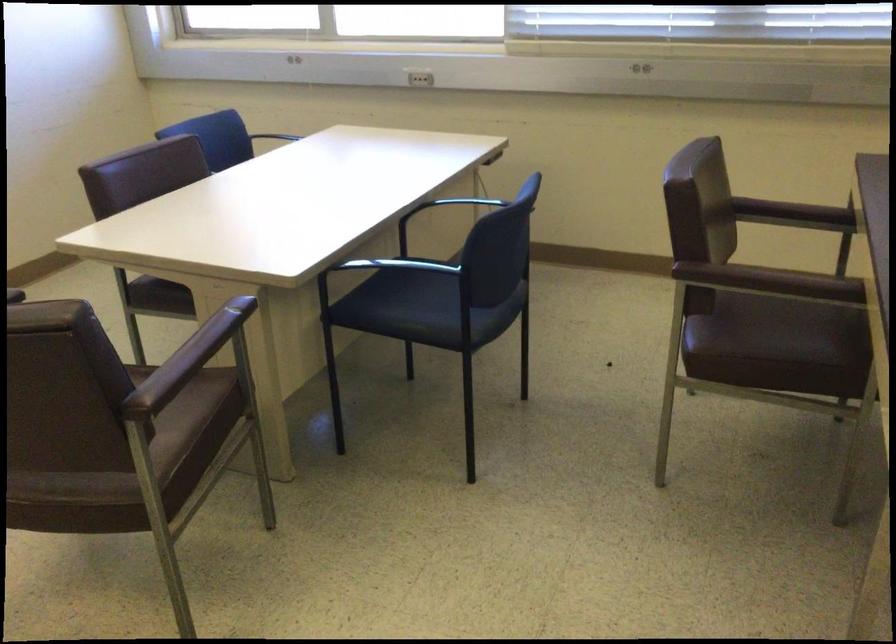
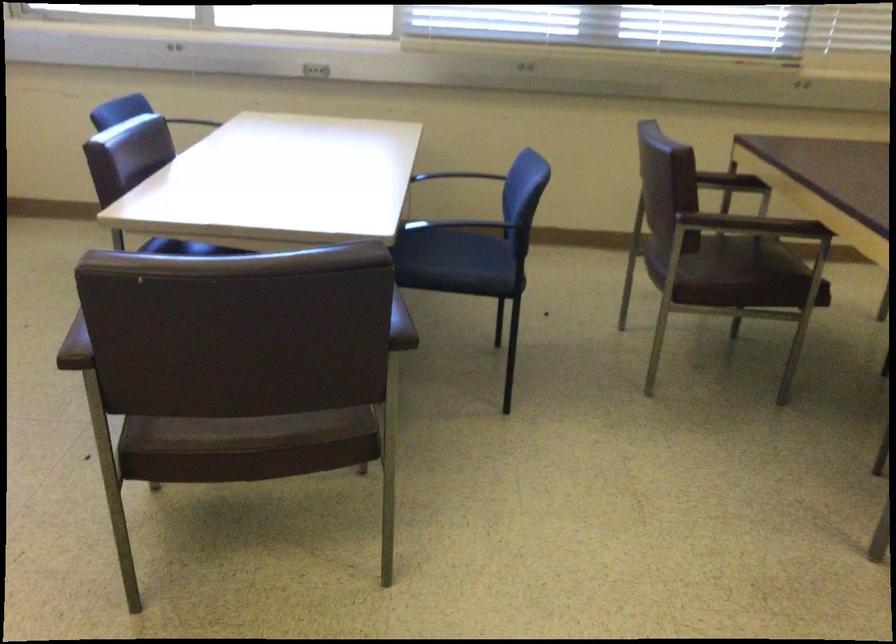
The point at (x=821, y=214) is marked in the first image. Where is the corresponding point in the second image?

(730, 182)